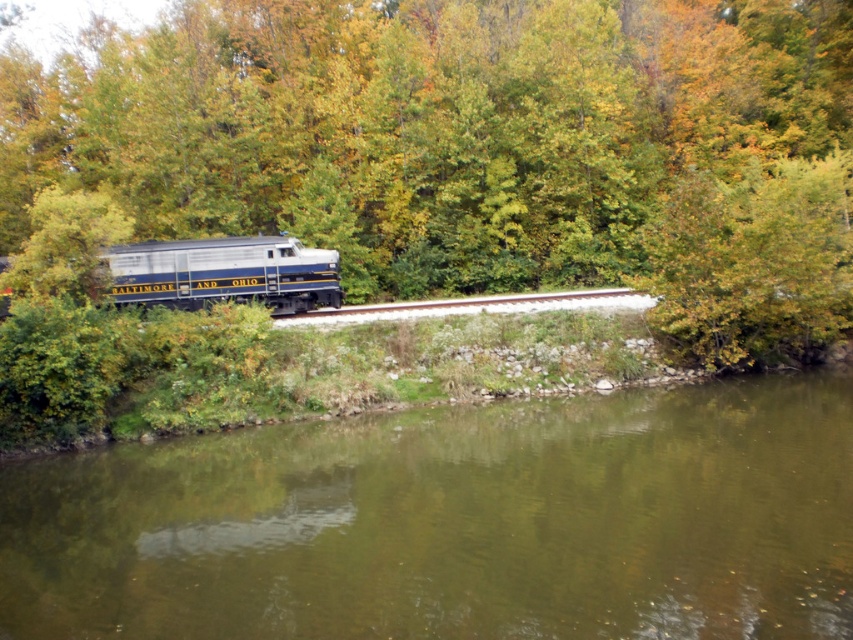
Who is higher up, greenish-brown water at lower center or silver metallic locomotive at center?

silver metallic locomotive at center is higher up.

Based on the photo, is greenish-brown water at lower center thinner than silver metallic locomotive at center?

No.

Who is more forward, (223, 442) or (200, 291)?

Point (223, 442) is in front.

Find the location of a particular element. This screenshot has height=640, width=853. greenish-brown water at lower center is located at coordinates (454, 524).

This screenshot has width=853, height=640. I want to click on green leafy tree at center, so click(x=477, y=147).

Does green leafy tree at center have a lesser width compared to silver metallic locomotive at center?

In fact, green leafy tree at center might be wider than silver metallic locomotive at center.

Between point (200, 221) and point (322, 272), which one is positioned in front?

Point (322, 272) is in front.

Find the location of a particular element. This screenshot has height=640, width=853. green leafy tree at center is located at coordinates (477, 147).

Consider the image. Can you confirm if green leafy tree at center is positioned to the right of metal train track at center?

Incorrect, green leafy tree at center is not on the right side of metal train track at center.

Is green leafy tree at center to the left of metal train track at center from the viewer's perspective?

Correct, you'll find green leafy tree at center to the left of metal train track at center.

Which is in front, point (815, 296) or point (480, 307)?

Point (815, 296)

At what (x,y) coordinates should I click in order to perform the action: click on green leafy tree at center. Please return your answer as a coordinate pair (x, y). Looking at the image, I should click on (477, 147).